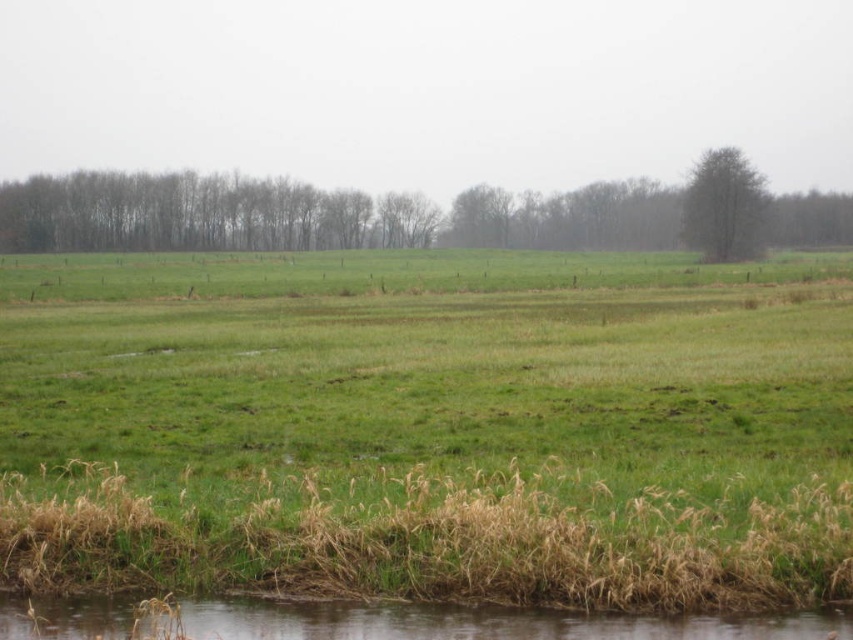
Question: Which of the following is the closest to the observer?

Choices:
 (A) (831, 244)
 (B) (618, 221)
 (C) (566, 381)

Answer: (C)

Question: Observing the image, what is the correct spatial positioning of gray textured tree at upper right in reference to green leafy tree at center?

Choices:
 (A) left
 (B) right

Answer: (B)

Question: Is green grassy river at lower center closer to the viewer compared to green leafy tree at upper right?

Choices:
 (A) yes
 (B) no

Answer: (A)

Question: Can you confirm if green grassy at lower left is positioned above green grassy river at lower center?

Choices:
 (A) no
 (B) yes

Answer: (B)

Question: Which object is positioned closest to the green leafy tree at upper right?

Choices:
 (A) green grassy at lower left
 (B) green leafy trees at upper center
 (C) green grassy river at lower center
 (D) gray textured tree at upper right

Answer: (D)

Question: Which point appears farthest from the camera in this image?

Choices:
 (A) (704, 230)
 (B) (271, 620)
 (C) (593, 192)
 (D) (776, 227)

Answer: (C)